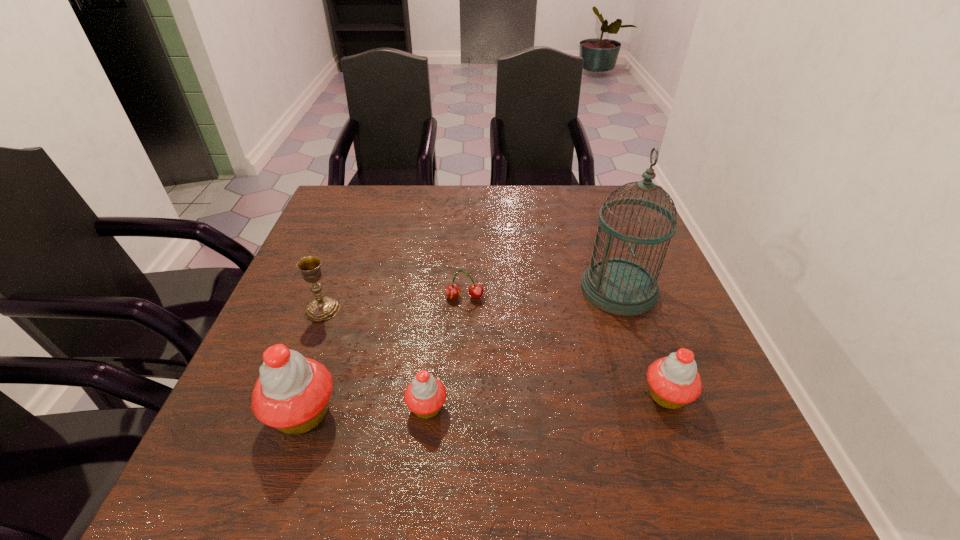
In order to click on object that is at the near right corner in this screenshot , I will do `click(674, 381)`.

Identify the location of vacant space at the far edge. This screenshot has width=960, height=540. (419, 204).

At what (x,y) coordinates should I click in order to perform the action: click on vacant space at the near edge. Please return your answer as a coordinate pair (x, y). Image resolution: width=960 pixels, height=540 pixels. Looking at the image, I should click on (485, 413).

The image size is (960, 540). I want to click on free space at the left edge of the desktop, so click(x=348, y=268).

You are a GUI agent. You are given a task and a screenshot of the screen. Output one action in this format:
    pyautogui.click(x=<x>, y=<y>)
    Task: Click on the free space at the right edge
    The height and width of the screenshot is (540, 960).
    Given the screenshot: What is the action you would take?
    pyautogui.click(x=624, y=255)

Where is `vacant space at the far left corner of the desktop`? This screenshot has width=960, height=540. vacant space at the far left corner of the desktop is located at coordinates (368, 223).

The height and width of the screenshot is (540, 960). In the image, there is a desktop. In order to click on vacant space at the near right corner in this screenshot , I will do `click(646, 402)`.

In order to click on vacant area between the tallest object and the rightmost cupcake in this screenshot , I will do 643,342.

The image size is (960, 540). I want to click on free space between the cherry and the chalice, so click(394, 303).

Image resolution: width=960 pixels, height=540 pixels. I want to click on vacant point located between the cherry and the chalice, so click(394, 303).